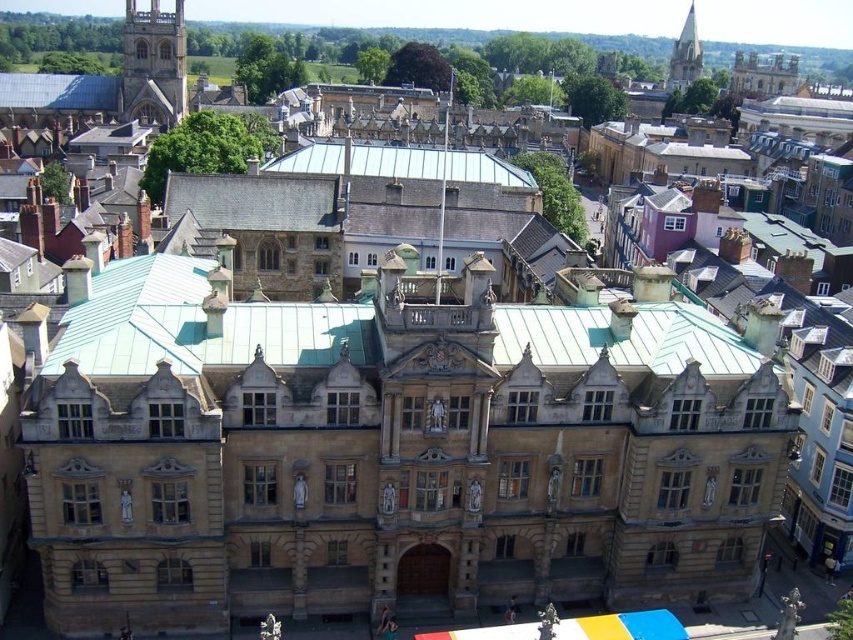
Based on the photo, you are a drone operator tasked with capturing aerial footage of the green tile roof at center and the stone tower at upper left. Based on their heights, which object should you adjust your camera angle to focus on first if you want to ensure both are in frame without needing to move the drone?

The green tile roof at center is shorter than the stone tower at upper left, so you should focus on the stone tower at upper left first to ensure both are in frame.

You are a drone operator tasked with capturing aerial footage of the historic building. Your drone is currently hovering at the point with coordinates point (361, 161). What part of the building will the drone be directly above?

The point (361, 161) corresponds to the green tile roof at center, so the drone will be directly above the green tile roof at center.

You are a drone operator planning to take a photo of the central building. The drone is currently at the stone tower at upper left. To frame the central building properly, you need to move the drone to the right. How far to the right should you move the drone in terms of the image coordinates?

The stone tower at upper left is located at point coordinates of 0.102 in the x direction and 0.181 in the y direction. To frame the central building properly, the drone should move to the right until the x coordinate reaches the center of the image, which is 0.5. Therefore, the drone needs to move right by 0.5 minus 0.102, which is 0.398 units in the x direction.